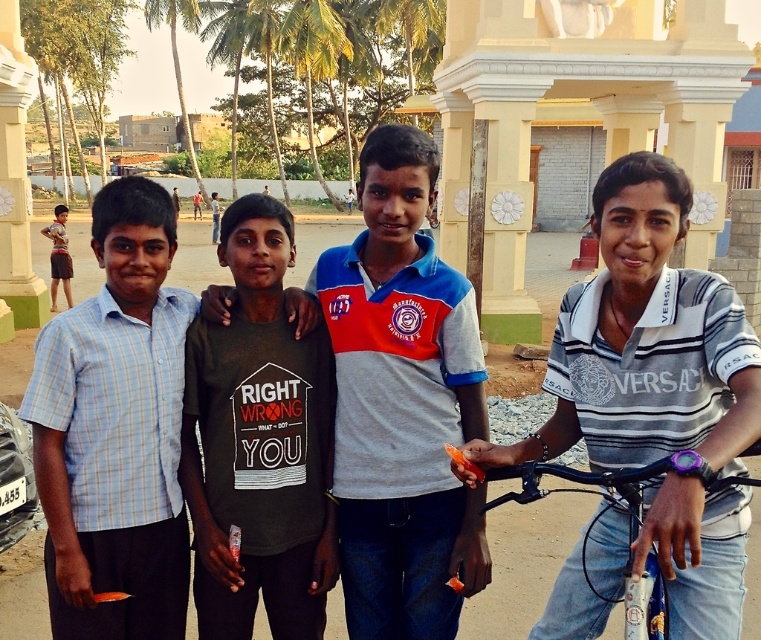
Where is `gray striped polo shirt at right`? Image resolution: width=761 pixels, height=640 pixels. gray striped polo shirt at right is located at coordinates (645, 340).

Can you confirm if gray striped polo shirt at right is thinner than light blue plaid shirt at left?

Incorrect, gray striped polo shirt at right's width is not less than light blue plaid shirt at left's.

Does gray striped polo shirt at right have a larger size compared to light blue plaid shirt at left?

Correct, gray striped polo shirt at right is larger in size than light blue plaid shirt at left.

Is point (658, 317) more distant than point (151, 340)?

No.

At what (x,y) coordinates should I click in order to perform the action: click on gray striped polo shirt at right. Please return your answer as a coordinate pair (x, y). The width and height of the screenshot is (761, 640). Looking at the image, I should click on (645, 340).

What do you see at coordinates (115, 429) in the screenshot? I see `light blue plaid shirt at left` at bounding box center [115, 429].

In the scene shown: Who is more forward, (99,362) or (632,552)?

Point (632,552) is in front.

Describe the element at coordinates (115, 429) in the screenshot. I see `light blue plaid shirt at left` at that location.

The height and width of the screenshot is (640, 761). Identify the location of light blue plaid shirt at left. point(115,429).